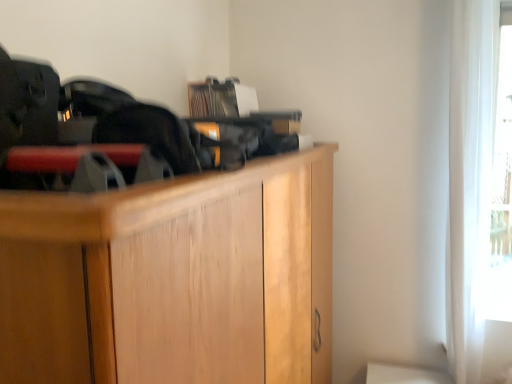
Question: In the image, is light brown wood cabinet at center on the left side or the right side of white sheer curtain at right?

Choices:
 (A) left
 (B) right

Answer: (A)

Question: Is light brown wood cabinet at center in front of or behind white sheer curtain at right in the image?

Choices:
 (A) front
 (B) behind

Answer: (A)

Question: Based on their sizes in the image, would you say light brown wood cabinet at center is bigger or smaller than white sheer curtain at right?

Choices:
 (A) big
 (B) small

Answer: (A)

Question: From a real-world perspective, is white sheer curtain at right positioned above or below light brown wood cabinet at center?

Choices:
 (A) below
 (B) above

Answer: (B)

Question: Does point (453, 74) appear closer or farther from the camera than point (7, 281)?

Choices:
 (A) farther
 (B) closer

Answer: (A)

Question: In terms of height, does white sheer curtain at right look taller or shorter compared to light brown wood cabinet at center?

Choices:
 (A) tall
 (B) short

Answer: (A)

Question: Choose the correct answer: Is white sheer curtain at right inside light brown wood cabinet at center or outside it?

Choices:
 (A) outside
 (B) inside

Answer: (A)